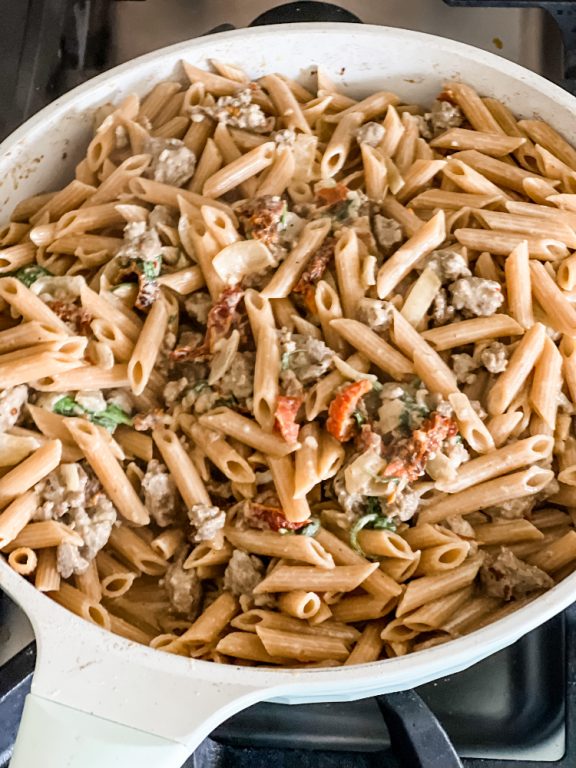
This screenshot has width=576, height=768. In order to click on handle of pot in this screenshot , I will do `click(100, 730)`.